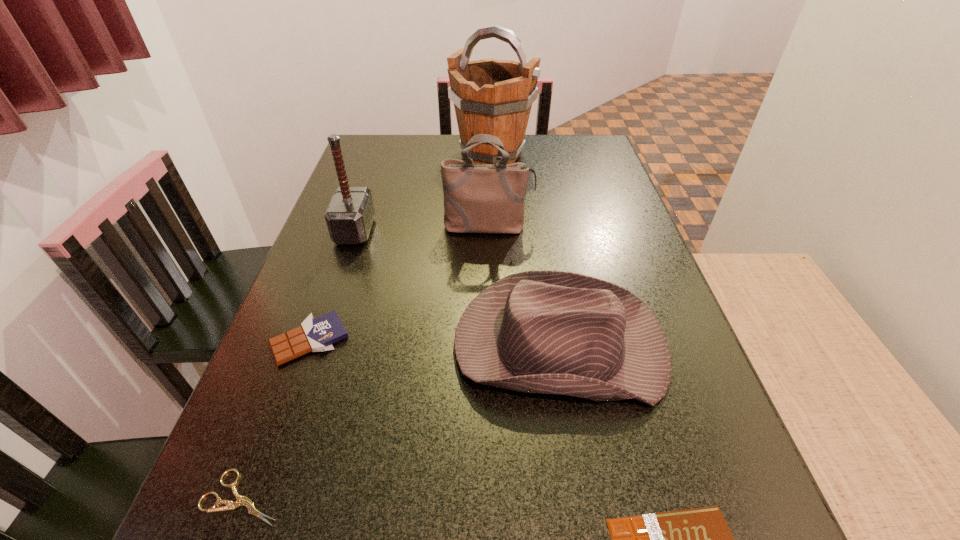
The image size is (960, 540). I want to click on vacant region located on the front of the hammer, so (298, 400).

Find the location of `free space located on the back of the fourth tallest object`. free space located on the back of the fourth tallest object is located at coordinates (534, 192).

The height and width of the screenshot is (540, 960). In order to click on blank area located 0.060m on the back of the left chocolate bar in this screenshot , I will do [326, 294].

Where is `blank space located on the right of the shears`? blank space located on the right of the shears is located at coordinates (333, 497).

Identify the location of object situated at the far edge. (490, 96).

Identify the location of hammer present at the left edge. This screenshot has height=540, width=960. (349, 217).

Image resolution: width=960 pixels, height=540 pixels. Find the location of `chocolate bar at the left edge`. chocolate bar at the left edge is located at coordinates (318, 334).

Where is `shears present at the left edge`? shears present at the left edge is located at coordinates (240, 500).

The height and width of the screenshot is (540, 960). I want to click on object that is at the right edge, so click(550, 332).

In the image, there is a desktop. What are the coordinates of `vacant region at the far edge` in the screenshot? It's located at (540, 148).